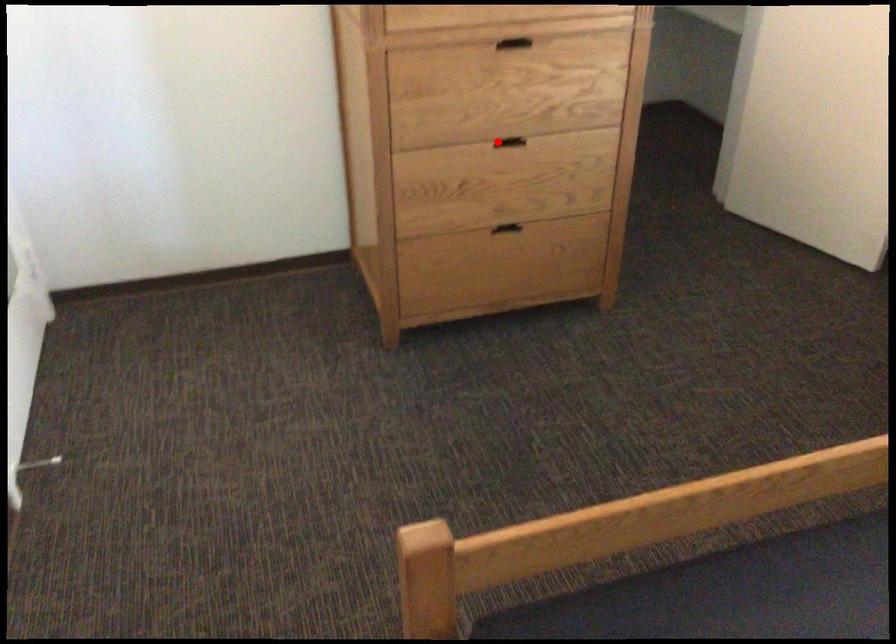
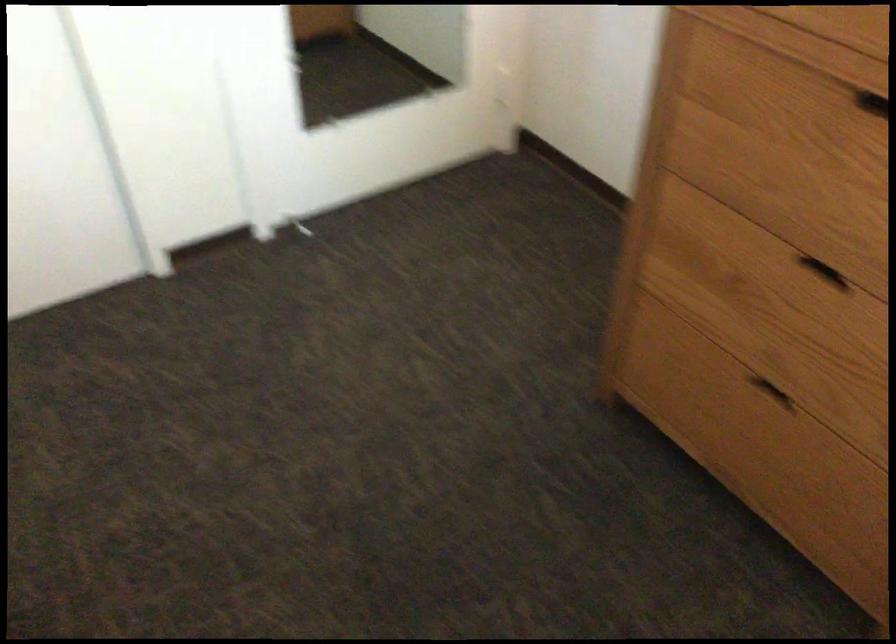
Find the pixel in the second image that matches the highlighted location in the first image.

(824, 272)